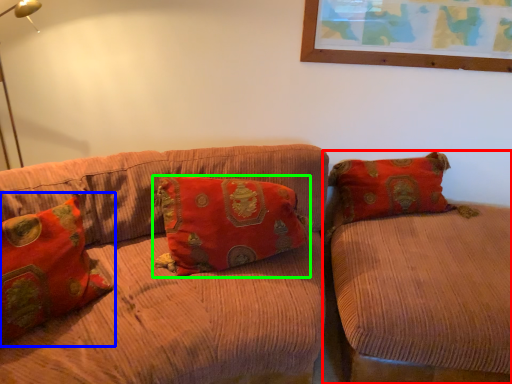
Question: Based on their relative distances, which object is farther from studio couch (highlighted by a red box)? Choose from pillow (highlighted by a blue box) and pillow (highlighted by a green box).

Choices:
 (A) pillow
 (B) pillow

Answer: (A)